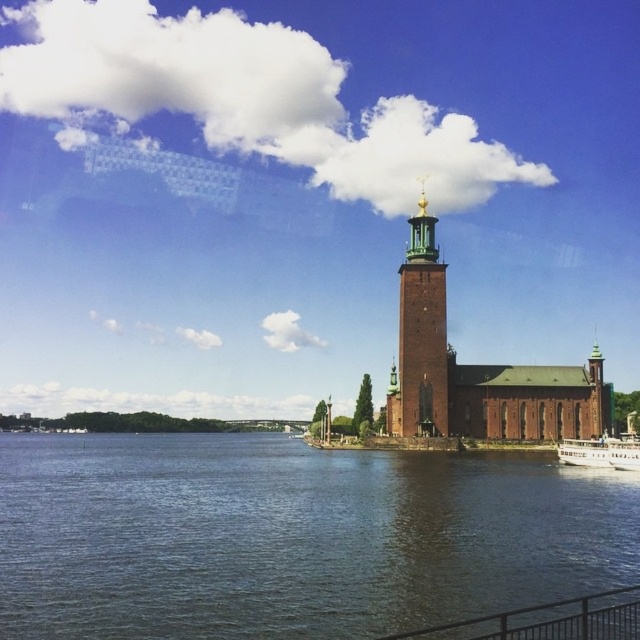
Question: Estimate the real-world distances between objects in this image. Which object is farther from the black metal railing at lower right?

Choices:
 (A) dark blue water at center
 (B) brown brick church at center

Answer: (B)

Question: Does red brick tower at center have a smaller size compared to black metal railing at lower right?

Choices:
 (A) yes
 (B) no

Answer: (B)

Question: Which of the following is the farthest from the observer?

Choices:
 (A) (396, 408)
 (B) (227, 586)
 (C) (628, 621)
 (D) (436, 289)

Answer: (A)

Question: Can you confirm if dark blue water at center is thinner than brown brick church at center?

Choices:
 (A) yes
 (B) no

Answer: (B)

Question: Which object appears closest to the camera in this image?

Choices:
 (A) red brick tower at center
 (B) black metal railing at lower right
 (C) brown brick church at center

Answer: (B)

Question: Does red brick tower at center appear on the left side of black metal railing at lower right?

Choices:
 (A) no
 (B) yes

Answer: (B)